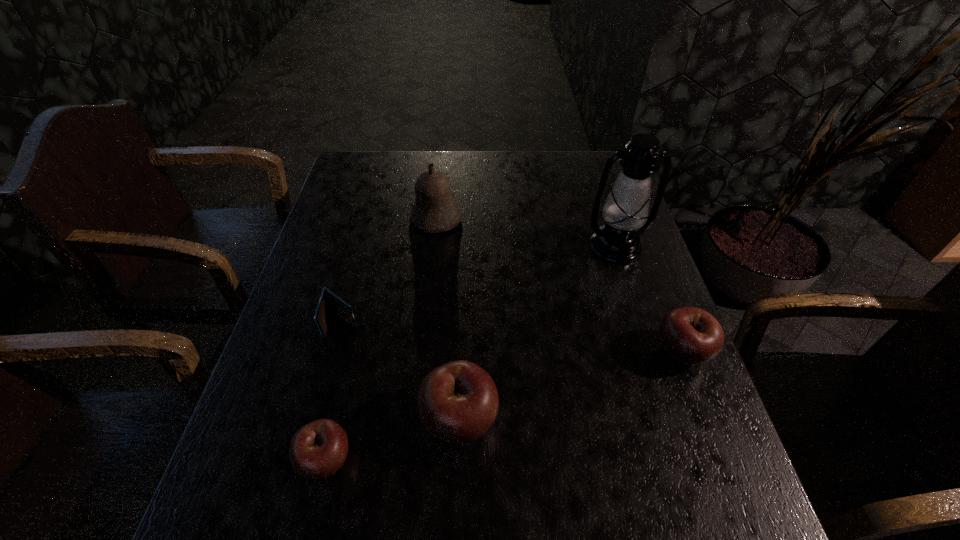
You are a GUI agent. You are given a task and a screenshot of the screen. Output one action in this format:
    pyautogui.click(x=<x>, y=<y>)
    Task: Click on the object at the near left corner
    This screenshot has width=960, height=540.
    Given the screenshot: What is the action you would take?
    tap(317, 450)

Locate an element on the screen. The image size is (960, 540). free point at the far edge is located at coordinates (529, 158).

Where is `vacant space at the near edge of the desktop`? The width and height of the screenshot is (960, 540). vacant space at the near edge of the desktop is located at coordinates (386, 448).

Where is `vacant area at the left edge`? The image size is (960, 540). vacant area at the left edge is located at coordinates (377, 232).

You are a GUI agent. You are given a task and a screenshot of the screen. Output one action in this format:
    pyautogui.click(x=<x>, y=<y>)
    Task: Click on the free space at the right edge
    Image resolution: width=960 pixels, height=540 pixels.
    Given the screenshot: What is the action you would take?
    pyautogui.click(x=590, y=254)

In the image, there is a desktop. At what (x,y) coordinates should I click in order to perform the action: click on vacant space at the near left corner. Please return your answer as a coordinate pair (x, y). Looking at the image, I should click on (262, 470).

Where is `free space between the second tallest object and the tallest apple`? free space between the second tallest object and the tallest apple is located at coordinates (447, 319).

Locate an element on the screen. This screenshot has height=540, width=960. free spot between the bell and the tallest apple is located at coordinates (447, 319).

This screenshot has width=960, height=540. Find the location of `vacant space that's between the third tallest object and the shortest apple`. vacant space that's between the third tallest object and the shortest apple is located at coordinates (393, 439).

You are a GUI agent. You are given a task and a screenshot of the screen. Output one action in this format:
    pyautogui.click(x=<x>, y=<y>)
    Task: Click on the free space between the third tallest object and the shortest apple
    
    Given the screenshot: What is the action you would take?
    pyautogui.click(x=393, y=439)